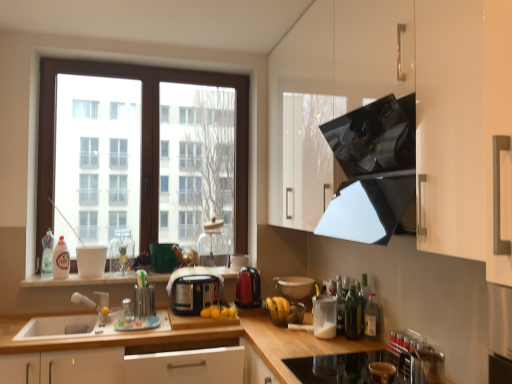
Question: Does green glass bottle at lower right, which is the fourth bottle from left to right, appear on the left side of glossy black exhaust hood at upper right?

Choices:
 (A) yes
 (B) no

Answer: (A)

Question: Is green glass bottle at lower right, which is the second bottle in right-to-left order, aimed at glossy black exhaust hood at upper right?

Choices:
 (A) no
 (B) yes

Answer: (A)

Question: From the image's perspective, is green glass bottle at lower right, placed as the second bottle when sorted from front to back, below glossy black exhaust hood at upper right?

Choices:
 (A) no
 (B) yes

Answer: (B)

Question: Is green glass bottle at lower right, which is the second bottle in right-to-left order, facing away from glossy black exhaust hood at upper right?

Choices:
 (A) yes
 (B) no

Answer: (B)

Question: Does green glass bottle at lower right, the fourth bottle viewed from the back, have a larger size compared to glossy black exhaust hood at upper right?

Choices:
 (A) yes
 (B) no

Answer: (B)

Question: In terms of size, does red glossy electric kettle at center, the first kitchen appliance positioned from the left, appear bigger or smaller than green glass bottle at lower right, placed as the second bottle when sorted from front to back?

Choices:
 (A) small
 (B) big

Answer: (B)

Question: Is red glossy electric kettle at center, arranged as the 1th kitchen appliance when viewed from the back, in front of or behind green glass bottle at lower right, which is the second bottle in right-to-left order, in the image?

Choices:
 (A) behind
 (B) front

Answer: (A)

Question: From the image's perspective, relative to green glass bottle at lower right, placed as the second bottle when sorted from front to back, is red glossy electric kettle at center, arranged as the 1th kitchen appliance when viewed from the back, above or below?

Choices:
 (A) below
 (B) above

Answer: (B)

Question: Is point (248, 274) closer or farther from the camera than point (355, 321)?

Choices:
 (A) closer
 (B) farther

Answer: (B)

Question: In terms of height, does matte brown bowl at center, placed as the third appliance when sorted from back to front, look taller or shorter compared to wooden at lower left?

Choices:
 (A) tall
 (B) short

Answer: (B)

Question: From a real-world perspective, is matte brown bowl at center, placed as the third appliance when sorted from back to front, above or below wooden at lower left?

Choices:
 (A) below
 (B) above

Answer: (B)

Question: Is matte brown bowl at center, the sixth appliance from the front, inside the boundaries of wooden at lower left, or outside?

Choices:
 (A) inside
 (B) outside

Answer: (B)

Question: Relative to wooden at lower left, is matte brown bowl at center, placed as the third appliance when sorted from back to front, in front or behind?

Choices:
 (A) front
 (B) behind

Answer: (B)

Question: Is green glass bottle at lower right, placed as the second bottle when sorted from front to back, situated inside matte brown bowl at center, placed as the third appliance when sorted from back to front, or outside?

Choices:
 (A) inside
 (B) outside

Answer: (B)

Question: From the image's perspective, is green glass bottle at lower right, placed as the second bottle when sorted from front to back, located above or below matte brown bowl at center, placed as the third appliance when sorted from back to front?

Choices:
 (A) below
 (B) above

Answer: (B)